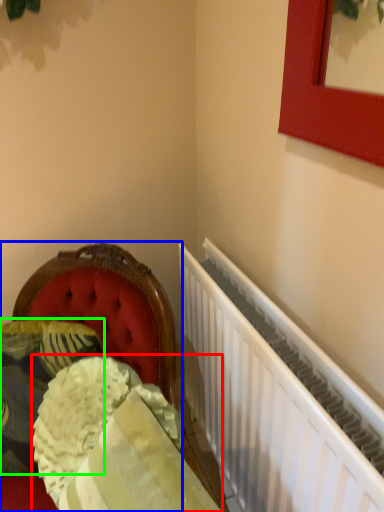
Question: Which is farther away from material (highlighted by a red box)? furniture (highlighted by a blue box) or pillow (highlighted by a green box)?

Choices:
 (A) furniture
 (B) pillow

Answer: (A)